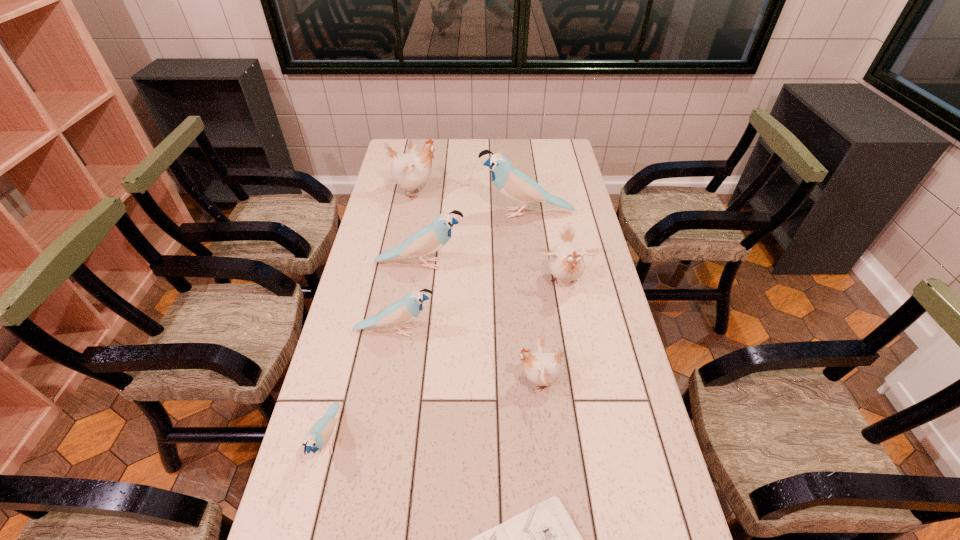
Select which white bird is the third closest to the fourth nearest object. Please provide its 2D coordinates. Your answer should be formatted as a tuple, i.e. [(x, y)], where the tuple contains the x and y coordinates of a point satisfying the conditions above.

[(411, 170)]

The width and height of the screenshot is (960, 540). I want to click on vacant region that satisfies the following two spatial constraints: 1. at the face of the rightmost blue bird; 2. at the face of the nearest blue bird, so click(x=554, y=439).

Find the location of a particular element. Image resolution: width=960 pixels, height=540 pixels. free location that satisfies the following two spatial constraints: 1. at the face of the farthest blue bird; 2. at the face of the nearest blue bird is located at coordinates (554, 439).